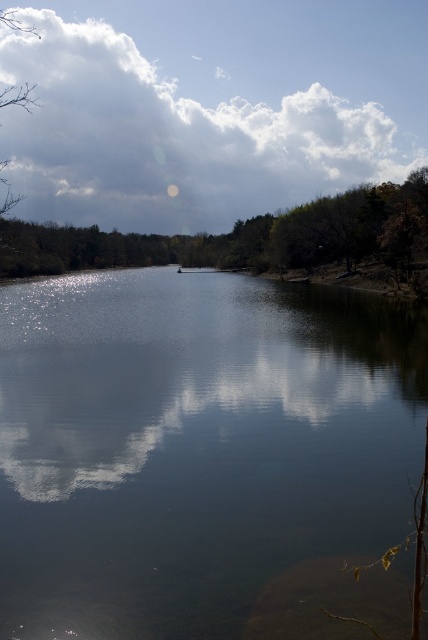
Can you confirm if clear water at center is smaller than green matte tree at upper center?

Indeed, clear water at center has a smaller size compared to green matte tree at upper center.

Can you confirm if clear water at center is positioned below green matte tree at upper center?

Yes, clear water at center is below green matte tree at upper center.

Who is more forward, (171, 321) or (41, 248)?

Point (171, 321)

I want to click on clear water at center, so click(205, 456).

Is white fluffy cloud at upper center positioned before green matte tree at upper center?

No, white fluffy cloud at upper center is behind green matte tree at upper center.

Does white fluffy cloud at upper center appear on the left side of green matte tree at upper center?

Incorrect, white fluffy cloud at upper center is not on the left side of green matte tree at upper center.

In order to click on white fluffy cloud at upper center in this screenshot , I will do `click(210, 106)`.

Where is `white fluffy cloud at upper center`? The height and width of the screenshot is (640, 428). white fluffy cloud at upper center is located at coordinates (210, 106).

Does clear water at center lie behind white fluffy cloud at upper center?

No, clear water at center is in front of white fluffy cloud at upper center.

Is the position of clear water at center less distant than that of white fluffy cloud at upper center?

Yes, clear water at center is in front of white fluffy cloud at upper center.

Between point (261, 420) and point (275, 132), which one is positioned behind?

Point (275, 132)

At what (x,y) coordinates should I click in order to perform the action: click on clear water at center. Please return your answer as a coordinate pair (x, y). Image resolution: width=428 pixels, height=640 pixels. Looking at the image, I should click on 205,456.